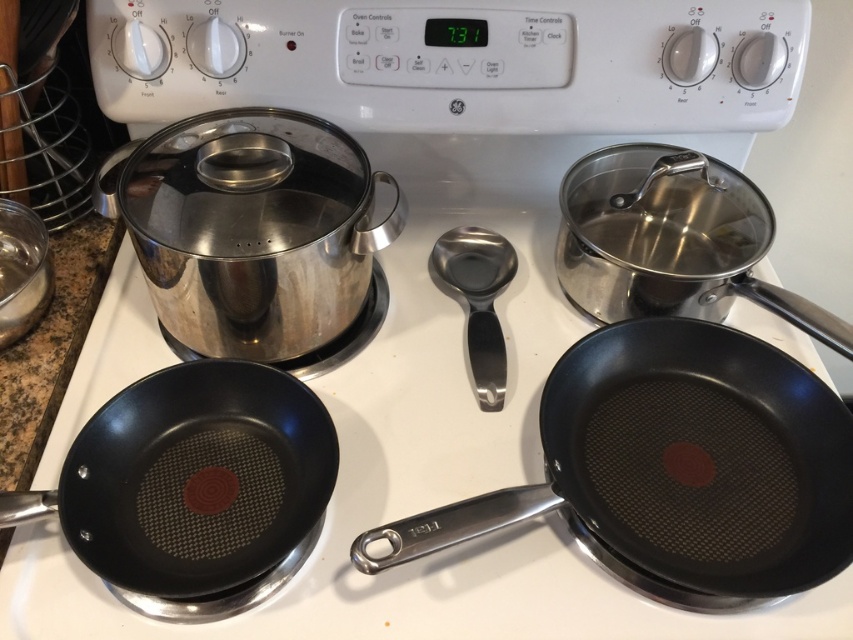
You are standing 24 inches away from the kitchen countertop. There is a point at coordinates point (531, 506). Can you reach that point without moving closer to the countertop?

The distance of point (531, 506) from viewer is 22.57 inches. Since you are standing 24 inches away, you are 1.43 inches too far to reach it without moving closer.

You are standing in front of the kitchen stove and want to reach two points on the countertop. The first point is at coordinate point (202, 403) and the second is at point (474, 337). Which point is closer to you?

Point (202, 403) is closer to the camera than point (474, 337), so the first point is closer to you.